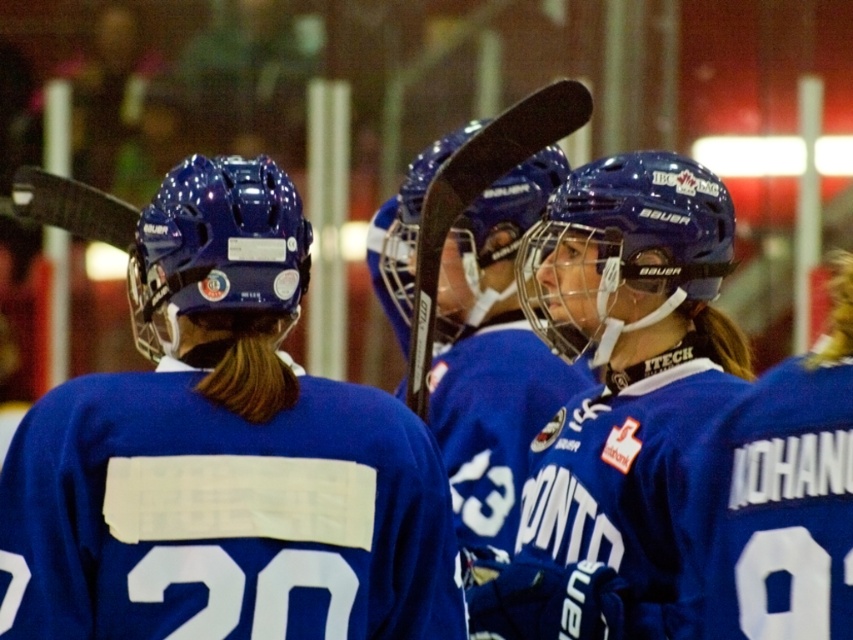
You are a photographer standing at the edge of the ice rink. You want to take a photo of the matte blue helmet at center and the blue jersey at center such that both are clearly visible. Given their sizes, which object should you focus on first to ensure proper focus?

The matte blue helmet at center has a greater height compared to the blue jersey at center. Therefore, you should focus on the matte blue helmet at center first since it is larger and requires more precise focus to capture details.